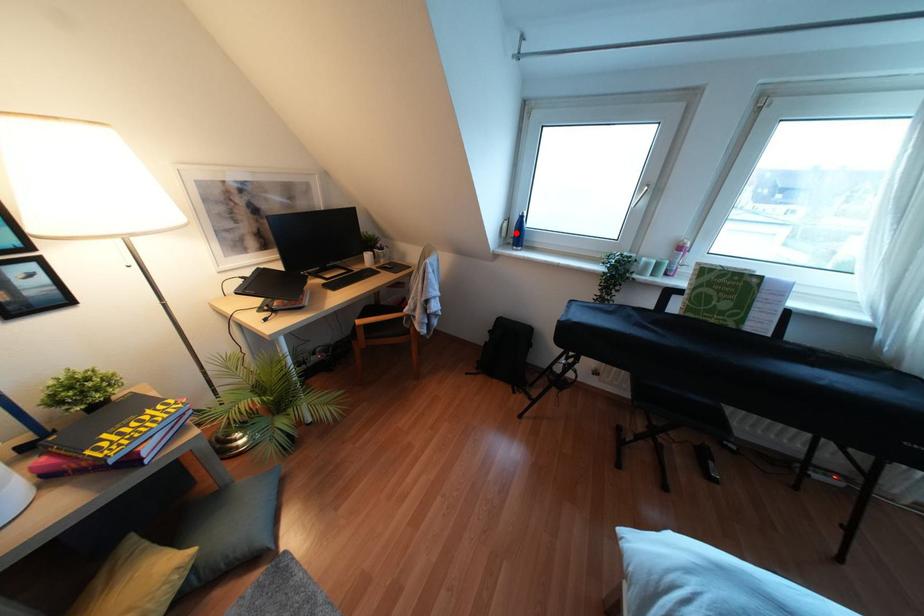
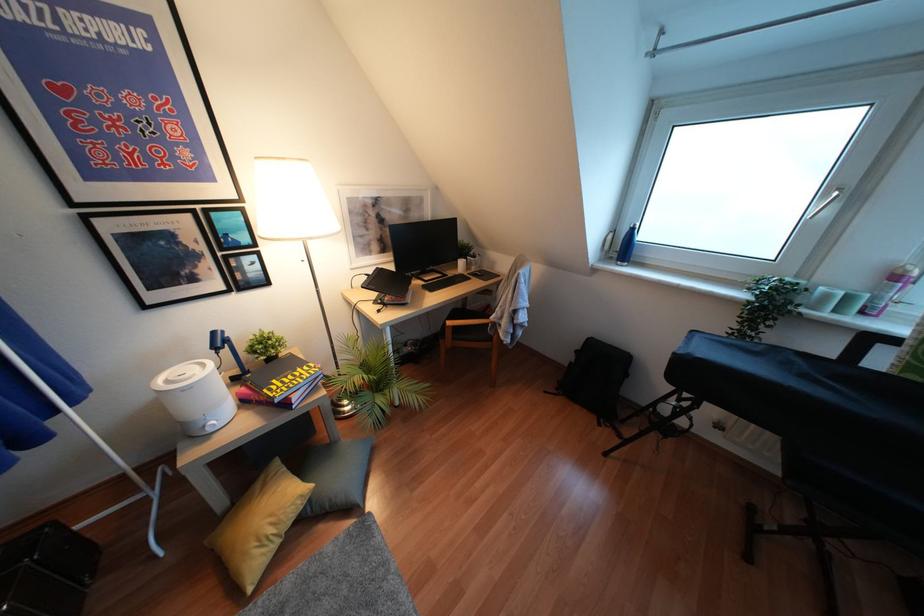
Find the pixel in the second image that matches the highlighted location in the first image.

(623, 246)